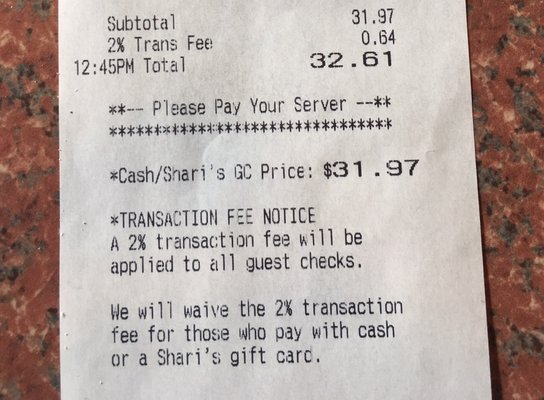
The width and height of the screenshot is (544, 400). Identify the location of countertop. (506, 144).